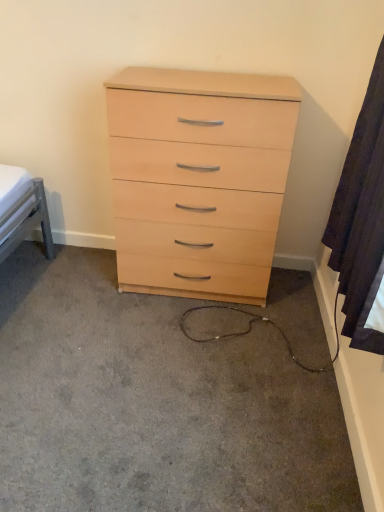
Image resolution: width=384 pixels, height=512 pixels. Identify the location of dark fabric curtain at right. (361, 216).

Where is `the chest of drawers below the dark fabric curtain at right (from a real-world perspective)`? Image resolution: width=384 pixels, height=512 pixels. the chest of drawers below the dark fabric curtain at right (from a real-world perspective) is located at coordinates coord(199,178).

Between dark fabric curtain at right and light wood/veneer chest of drawers at center, which one appears on the left side from the viewer's perspective?

From the viewer's perspective, light wood/veneer chest of drawers at center appears more on the left side.

Can you confirm if dark fabric curtain at right is wider than light wood/veneer chest of drawers at center?

In fact, dark fabric curtain at right might be narrower than light wood/veneer chest of drawers at center.

Is dark fabric curtain at right inside the boundaries of light wood/veneer chest of drawers at center, or outside?

dark fabric curtain at right is located beyond the bounds of light wood/veneer chest of drawers at center.

Is light wood dresser at center closer to camera compared to light wood/veneer chest of drawers at center?

That is True.

Image resolution: width=384 pixels, height=512 pixels. In order to click on concrete lying below the light wood/veneer chest of drawers at center (from the image's perspective) in this screenshot , I will do `click(153, 403)`.

Is light wood dresser at center spatially inside light wood/veneer chest of drawers at center, or outside of it?

light wood dresser at center is not inside light wood/veneer chest of drawers at center, it's outside.

Does light wood dresser at center have a greater width compared to light wood/veneer chest of drawers at center?

Correct, the width of light wood dresser at center exceeds that of light wood/veneer chest of drawers at center.

Considering the relative sizes of light wood/veneer chest of drawers at center and light wood dresser at center in the image provided, is light wood/veneer chest of drawers at center wider than light wood dresser at center?

Incorrect, the width of light wood/veneer chest of drawers at center does not surpass that of light wood dresser at center.

Can you confirm if light wood/veneer chest of drawers at center is smaller than light wood dresser at center?

Incorrect, light wood/veneer chest of drawers at center is not smaller in size than light wood dresser at center.

From a real-world perspective, is light wood/veneer chest of drawers at center below light wood dresser at center?

Incorrect, from a real-world perspective, light wood/veneer chest of drawers at center is higher than light wood dresser at center.

From the image's perspective, relative to dark fabric curtain at right, is light wood/veneer chest of drawers at center above or below?

Based on their image positions, light wood/veneer chest of drawers at center is located above dark fabric curtain at right.

Looking at this image, in terms of height, does light wood/veneer chest of drawers at center look taller or shorter compared to dark fabric curtain at right?

Clearly, light wood/veneer chest of drawers at center is taller compared to dark fabric curtain at right.

Which of these two, light wood/veneer chest of drawers at center or dark fabric curtain at right, is wider?

light wood/veneer chest of drawers at center is wider.

Considering the sizes of objects light wood dresser at center and dark fabric curtain at right in the image provided, who is shorter, light wood dresser at center or dark fabric curtain at right?

light wood dresser at center.

Is light wood dresser at center inside the boundaries of dark fabric curtain at right, or outside?

light wood dresser at center is not inside dark fabric curtain at right, it's outside.

Is light wood dresser at center far away from dark fabric curtain at right?

No, light wood dresser at center is not far from dark fabric curtain at right.

Is light wood dresser at center in front of dark fabric curtain at right?

That is False.

Do you think dark fabric curtain at right is within light wood dresser at center, or outside of it?

dark fabric curtain at right is not inside light wood dresser at center, it's outside.

Considering the sizes of objects dark fabric curtain at right and light wood dresser at center in the image provided, who is shorter, dark fabric curtain at right or light wood dresser at center?

light wood dresser at center is shorter.

In the image, is dark fabric curtain at right positioned in front of or behind light wood dresser at center?

dark fabric curtain at right is in front of light wood dresser at center.

Considering the points (345, 186) and (183, 462), which point is behind, point (345, 186) or point (183, 462)?

The point (345, 186) is behind.

I want to click on the chest of drawers beneath the dark fabric curtain at right (from a real-world perspective), so click(199, 178).

Locate an element on the screen. The width and height of the screenshot is (384, 512). the chest of drawers above the light wood dresser at center (from a real-world perspective) is located at coordinates (199, 178).

When comparing their distances from light wood/veneer chest of drawers at center, does light wood dresser at center or dark fabric curtain at right seem further?

light wood dresser at center is further to light wood/veneer chest of drawers at center.

Considering their positions, is light wood/veneer chest of drawers at center positioned further to dark fabric curtain at right than light wood dresser at center?

light wood dresser at center.

Based on their spatial positions, is light wood dresser at center or light wood/veneer chest of drawers at center further from dark fabric curtain at right?

Based on the image, light wood dresser at center appears to be further to dark fabric curtain at right.

Looking at the image, which one is located closer to light wood/veneer chest of drawers at center, dark fabric curtain at right or light wood dresser at center?

dark fabric curtain at right is closer to light wood/veneer chest of drawers at center.

Looking at the image, which one is located closer to light wood dresser at center, dark fabric curtain at right or light wood/veneer chest of drawers at center?

light wood/veneer chest of drawers at center is positioned closer to the anchor light wood dresser at center.

Considering their positions, is light wood/veneer chest of drawers at center positioned further to light wood dresser at center than dark fabric curtain at right?

Based on the image, dark fabric curtain at right appears to be further to light wood dresser at center.

The width and height of the screenshot is (384, 512). I want to click on concrete located between dark fabric curtain at right and light wood/veneer chest of drawers at center in the depth direction, so click(153, 403).